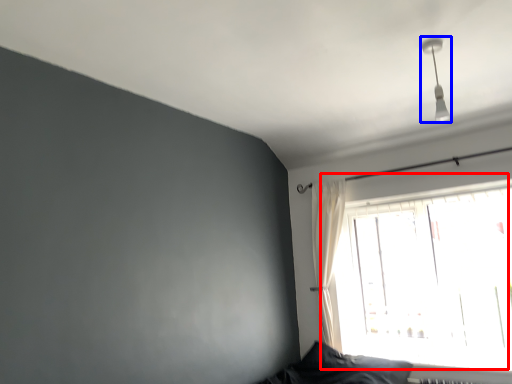
Question: Which object is closer to the camera taking this photo, window (highlighted by a red box) or fixture (highlighted by a blue box)?

Choices:
 (A) window
 (B) fixture

Answer: (B)